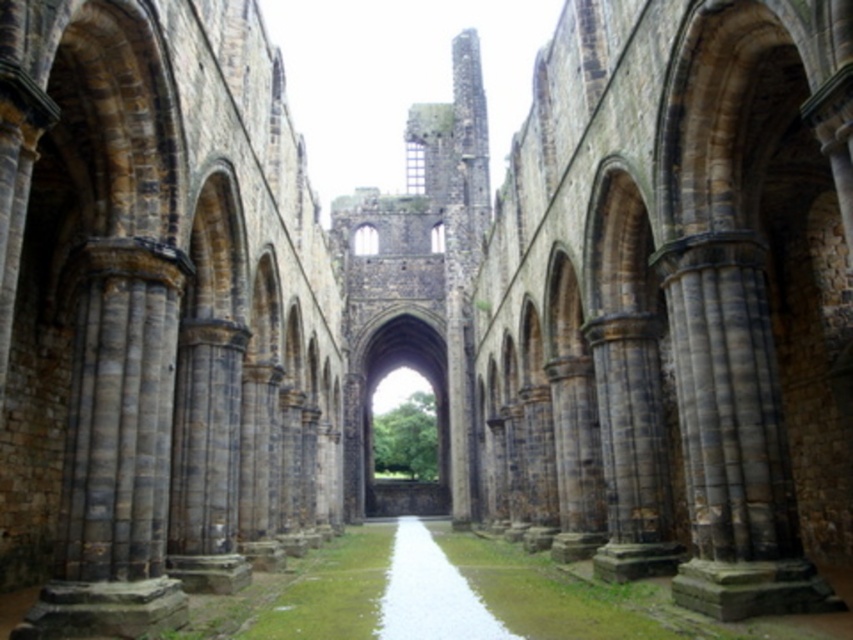
Can you confirm if stone archway at center is wider than white stone path at center?

Correct, the width of stone archway at center exceeds that of white stone path at center.

Which is more to the left, stone archway at center or white stone path at center?

Positioned to the left is stone archway at center.

Does point (367, 358) come in front of point (486, 614)?

No, it is not.

You are a GUI agent. You are given a task and a screenshot of the screen. Output one action in this format:
    pyautogui.click(x=<x>, y=<y>)
    Task: Click on the stone archway at center
    The image size is (853, 640).
    Given the screenshot: What is the action you would take?
    pyautogui.click(x=370, y=412)